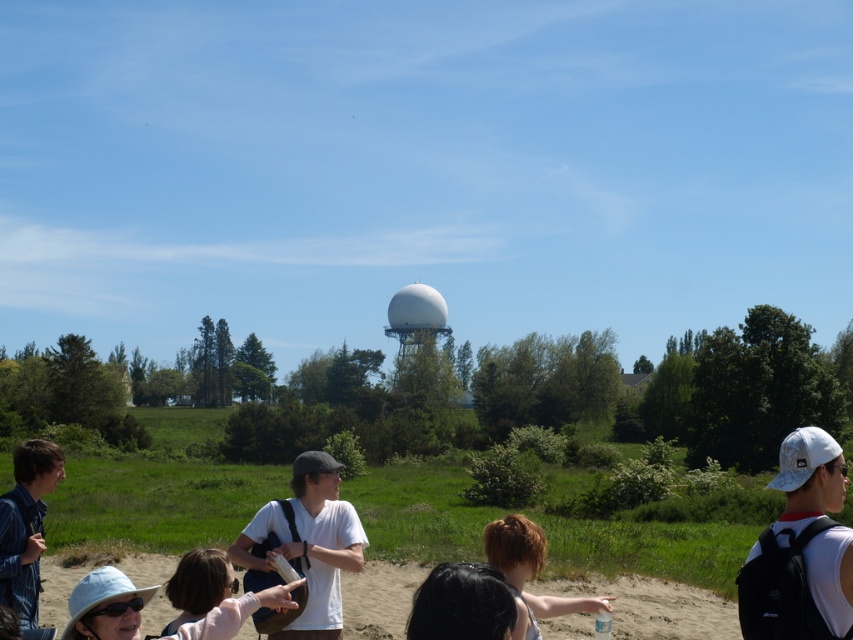
Question: Is the position of white matte cap at upper right more distant than that of denim jacket at lower left?

Choices:
 (A) yes
 (B) no

Answer: (A)

Question: Among these points, which one is farthest from the camera?

Choices:
 (A) (462, 618)
 (B) (15, 595)

Answer: (B)

Question: Which point appears farthest from the camera in this image?

Choices:
 (A) (343, 513)
 (B) (405, 342)
 (C) (80, 593)
 (D) (836, 449)

Answer: (B)

Question: Which of the following is the farthest from the observer?

Choices:
 (A) (311, 532)
 (B) (474, 593)
 (C) (506, 544)
 (D) (26, 500)

Answer: (A)

Question: From the image, what is the correct spatial relationship of matte white hat at lower left in relation to black hair at lower center?

Choices:
 (A) left
 (B) right

Answer: (A)

Question: Is white matte shirt at center thinner than denim jacket at lower left?

Choices:
 (A) yes
 (B) no

Answer: (A)